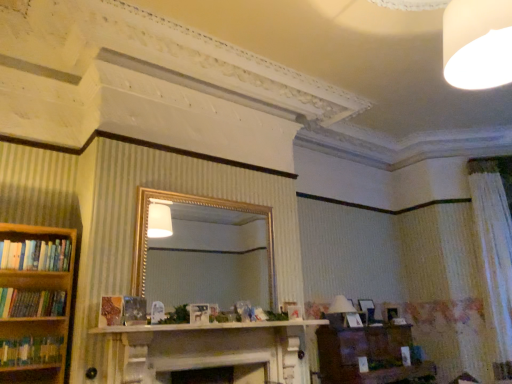
Locate an element on the screen. The image size is (512, 384). free space above hardcover books at left, the 1th book in the top-to-bottom sequence (from a real-world perspective) is located at coordinates (34, 240).